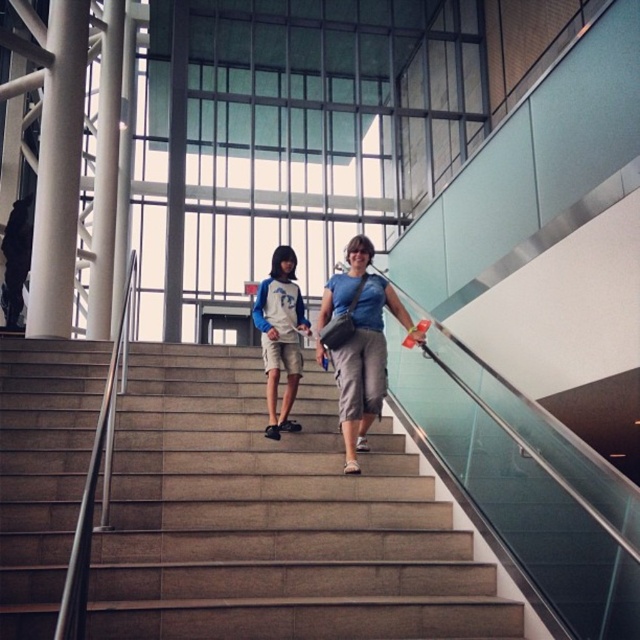
Question: Considering the relative positions of white glossy pillar at left and blue denim shorts at center in the image provided, where is white glossy pillar at left located with respect to blue denim shorts at center?

Choices:
 (A) left
 (B) right

Answer: (A)

Question: Which of the following is the farthest from the observer?

Choices:
 (A) (342, 406)
 (B) (44, 161)
 (C) (346, 634)

Answer: (B)

Question: Which object appears farthest from the camera in this image?

Choices:
 (A) concrete stairs at center
 (B) blue and white jersey at center

Answer: (B)

Question: From the image, what is the correct spatial relationship of concrete stairs at center in relation to blue denim shorts at center?

Choices:
 (A) above
 (B) below

Answer: (B)

Question: Which object is farther from the camera taking this photo?

Choices:
 (A) blue and white jersey at center
 (B) white glossy pillar at left

Answer: (B)

Question: Is white glossy pillar at left closer to the viewer compared to blue and white jersey at center?

Choices:
 (A) no
 (B) yes

Answer: (A)